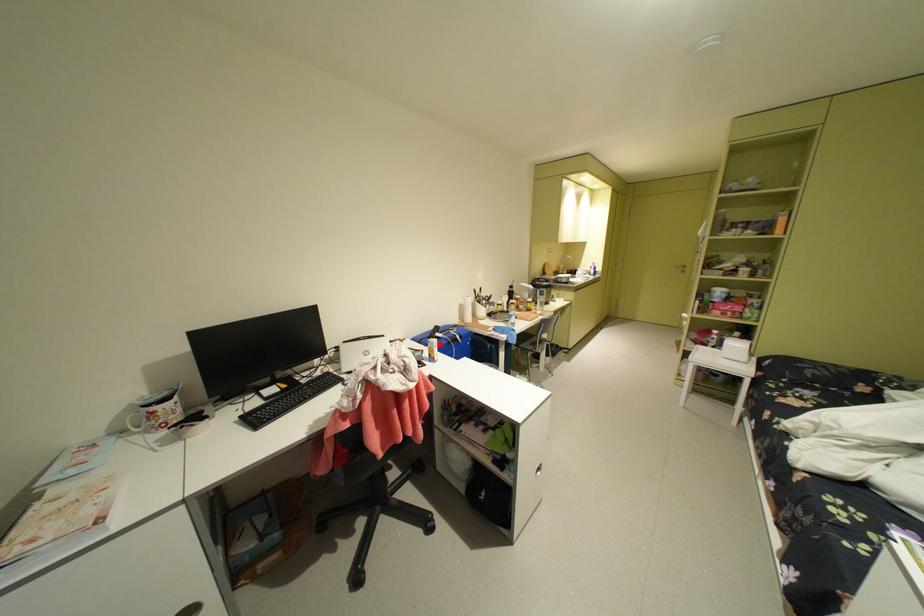
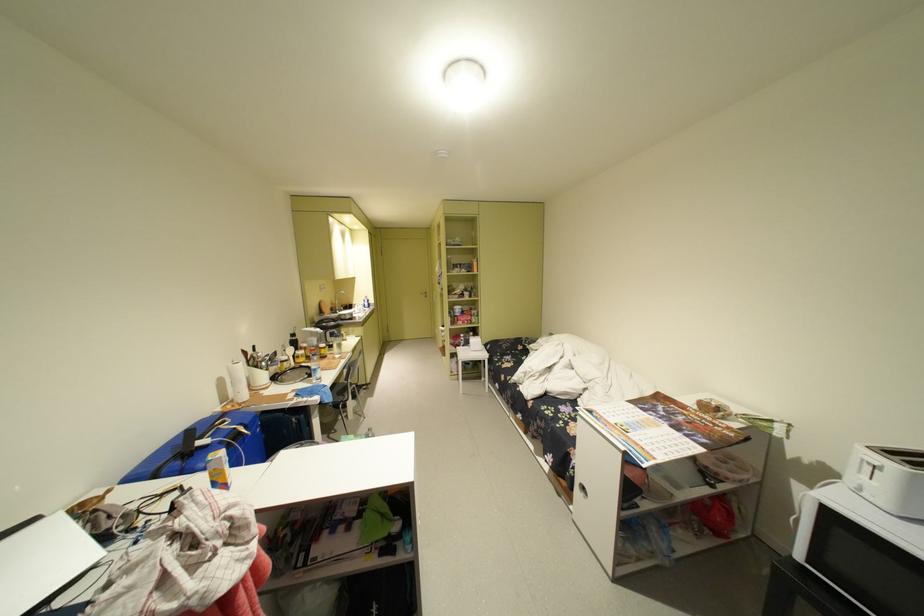
Locate, in the second image, the point that corresponds to the highlighted location in the first image.

(220, 464)